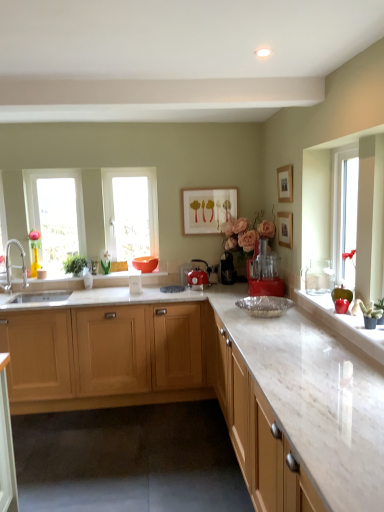
Image resolution: width=384 pixels, height=512 pixels. I want to click on free location above white marble countertop at right, the first cabinetry viewed from the front (from a real-world perspective), so click(278, 332).